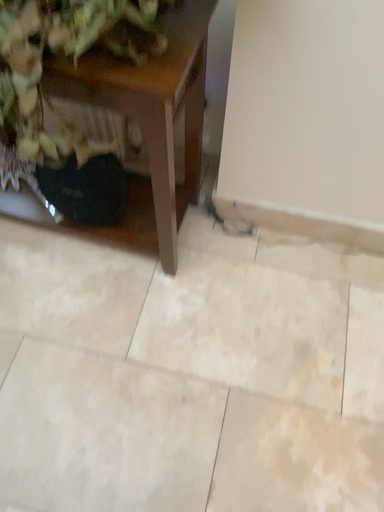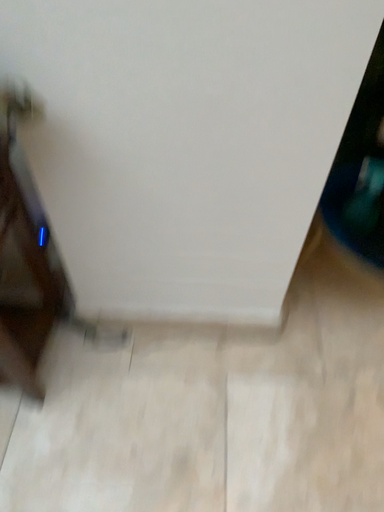
Question: Which way did the camera rotate in the video?

Choices:
 (A) rotated upward
 (B) rotated downward

Answer: (A)